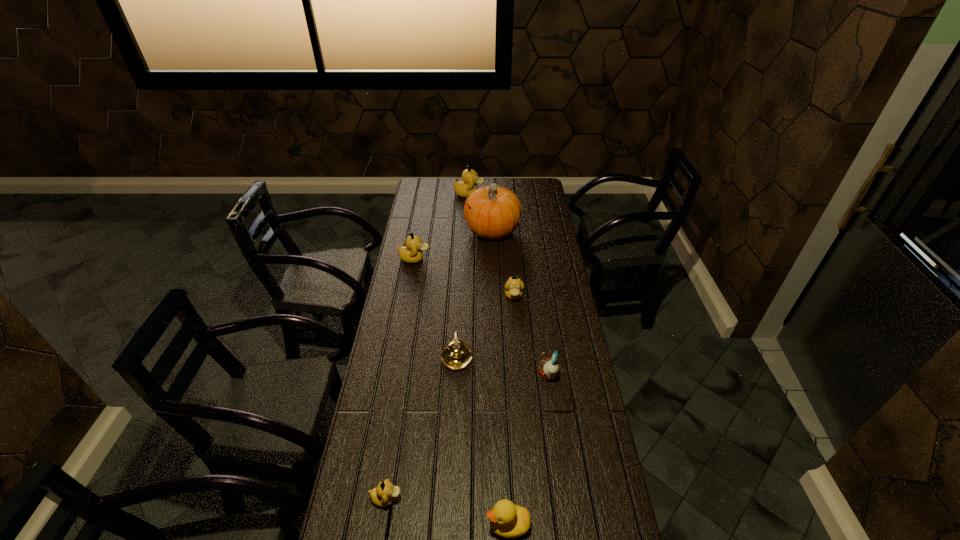
The width and height of the screenshot is (960, 540). In order to click on vacant space located 0.320m on the handle side of the candle holder in this screenshot , I will do `click(461, 284)`.

Locate an element on the screen. free space located on the face of the rightmost tan duckling is located at coordinates (520, 377).

Locate an element on the screen. vacant space located on the front-facing side of the pink muffin is located at coordinates (430, 375).

Where is `blank area located 0.160m on the front-facing side of the pink muffin`? blank area located 0.160m on the front-facing side of the pink muffin is located at coordinates (493, 375).

The height and width of the screenshot is (540, 960). What are the coordinates of `vacant space situated on the front-facing side of the pink muffin` in the screenshot? It's located at (486, 375).

This screenshot has height=540, width=960. Find the location of `vacant space located 0.260m on the face of the shortest object`. vacant space located 0.260m on the face of the shortest object is located at coordinates (492, 498).

The height and width of the screenshot is (540, 960). Find the location of `object that is at the far edge`. object that is at the far edge is located at coordinates (464, 188).

Where is `object at the right edge`? object at the right edge is located at coordinates (549, 368).

Identify the location of vacant region at the far edge of the desktop. Image resolution: width=960 pixels, height=540 pixels. (452, 191).

You are a GUI agent. You are given a task and a screenshot of the screen. Output one action in this format:
    pyautogui.click(x=<x>, y=<y>)
    Task: Click on the vacant space at the left edge
    The height and width of the screenshot is (540, 960).
    Given the screenshot: What is the action you would take?
    [x=429, y=218]